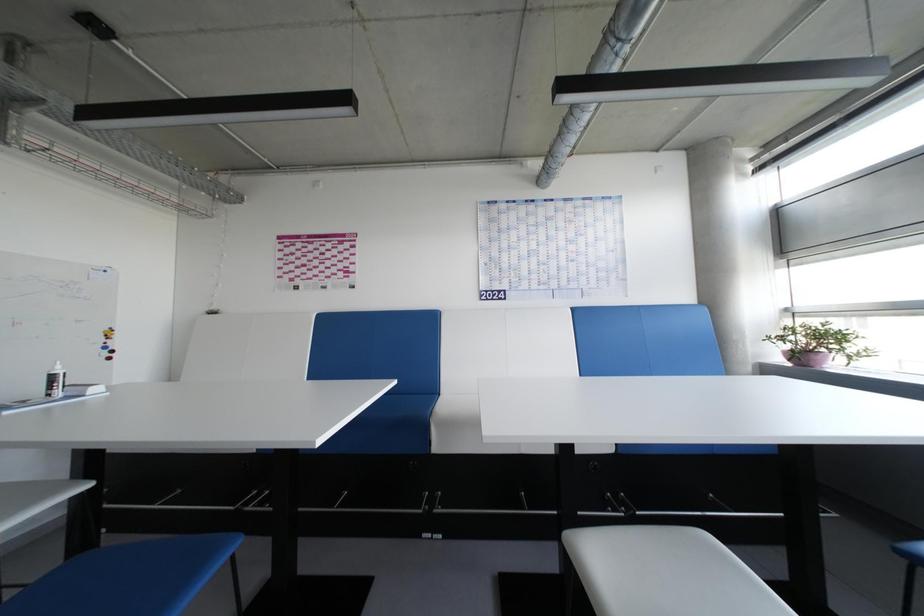
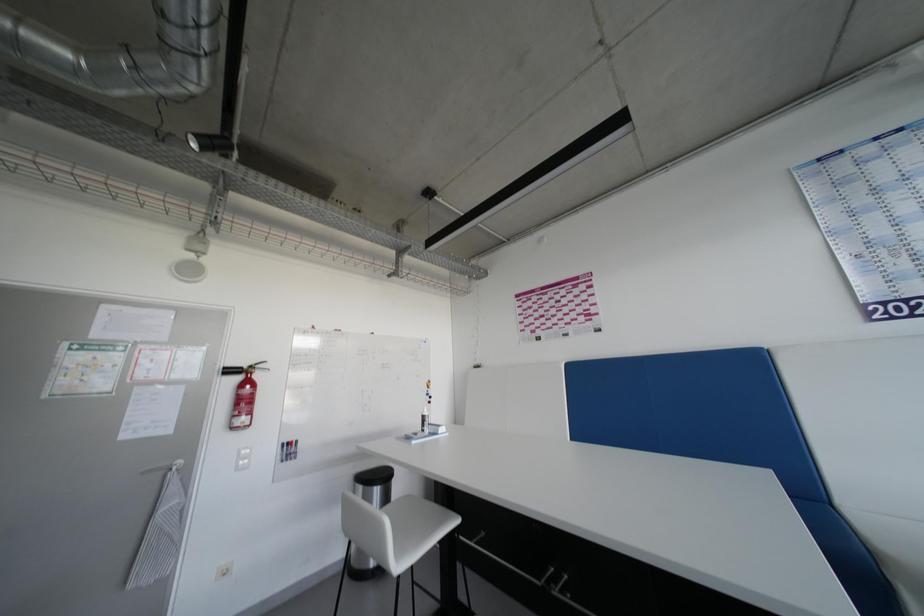
Question: Based on the continuous images, in which direction is the camera rotating? Reply with the corresponding letter.

Choices:
 (A) Left
 (B) Right
 (C) Up
 (D) Down

Answer: (A)